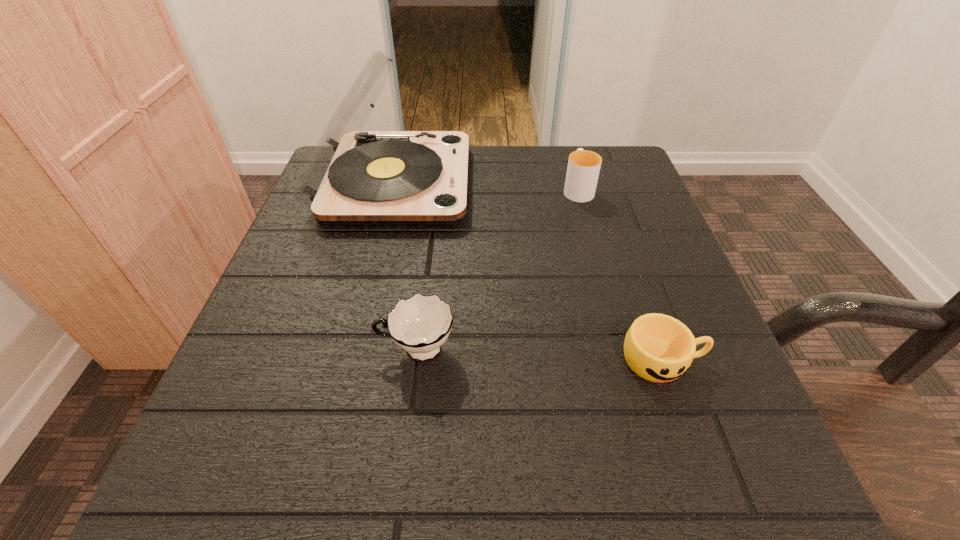
Locate an element on the screen. This screenshot has height=540, width=960. record player is located at coordinates 353,177.

This screenshot has height=540, width=960. What are the coordinates of `the farthest cup` in the screenshot? It's located at (583, 169).

This screenshot has width=960, height=540. I want to click on the leftmost cup, so click(420, 324).

The height and width of the screenshot is (540, 960). Find the location of `the shortest cup`. the shortest cup is located at coordinates (659, 348).

The image size is (960, 540). What are the coordinates of `free region located with the tonearm facing the front of the tallest object` in the screenshot? It's located at (522, 183).

Find the location of a particular element. The height and width of the screenshot is (540, 960). vacant space situated 0.090m with the handle on the side of the farthest cup is located at coordinates (568, 156).

I want to click on free space located on the side of the leftmost cup with the handle, so pyautogui.click(x=256, y=350).

Find the location of `free location located on the side of the leftmost cup with the handle`. free location located on the side of the leftmost cup with the handle is located at coordinates (337, 350).

Identify the location of vacant space located on the side of the leftmost cup with the handle. (297, 350).

Locate an element on the screen. The height and width of the screenshot is (540, 960). vacant point located 0.390m on the back of the shortest object is located at coordinates (603, 191).